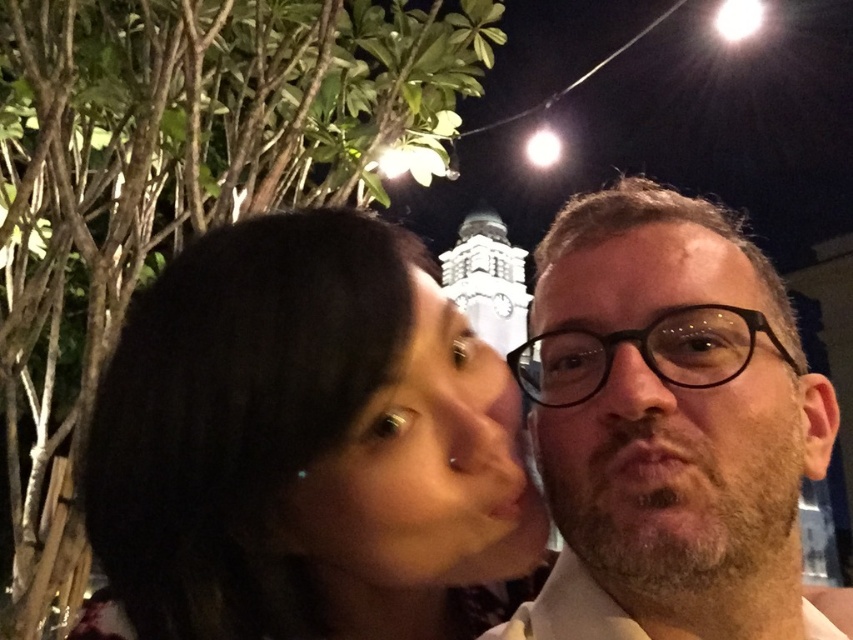
Question: Which point is closer to the camera?

Choices:
 (A) smooth skin face at center
 (B) dark brown hair at center
 (C) black plastic glasses at center
 (D) beige textured shirt at center

Answer: (B)

Question: Estimate the real-world distances between objects in this image. Which object is farther from the dark brown hair at center?

Choices:
 (A) beige textured shirt at center
 (B) black plastic glasses at center
 (C) smooth skin face at center

Answer: (B)

Question: Can you confirm if beige textured shirt at center is wider than black plastic glasses at center?

Choices:
 (A) yes
 (B) no

Answer: (A)

Question: Does dark brown hair at center appear over smooth skin face at center?

Choices:
 (A) yes
 (B) no

Answer: (B)

Question: Which of the following is the farthest from the observer?

Choices:
 (A) pyautogui.click(x=547, y=404)
 (B) pyautogui.click(x=479, y=502)
 (C) pyautogui.click(x=526, y=497)
 (D) pyautogui.click(x=563, y=365)

Answer: (D)

Question: In this image, where is dark brown hair at center located relative to black plastic glasses at center?

Choices:
 (A) below
 (B) above

Answer: (A)